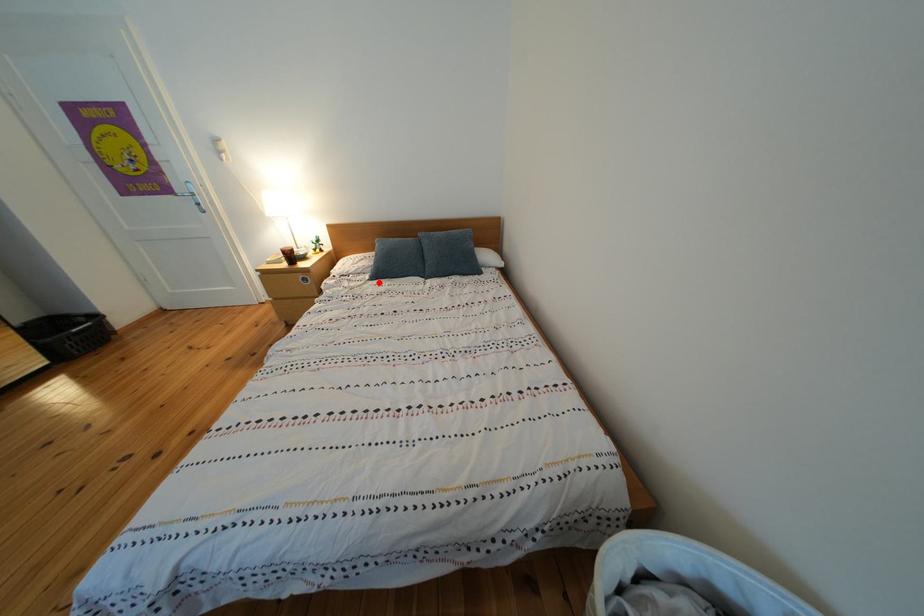
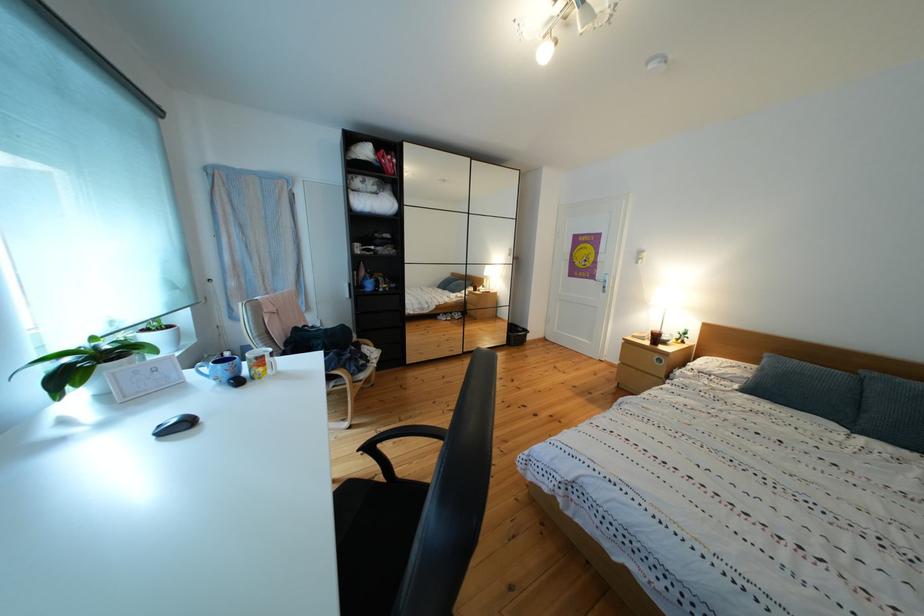
Where in the second image is the point corresponding to the highlighted location from the first image?

(748, 392)